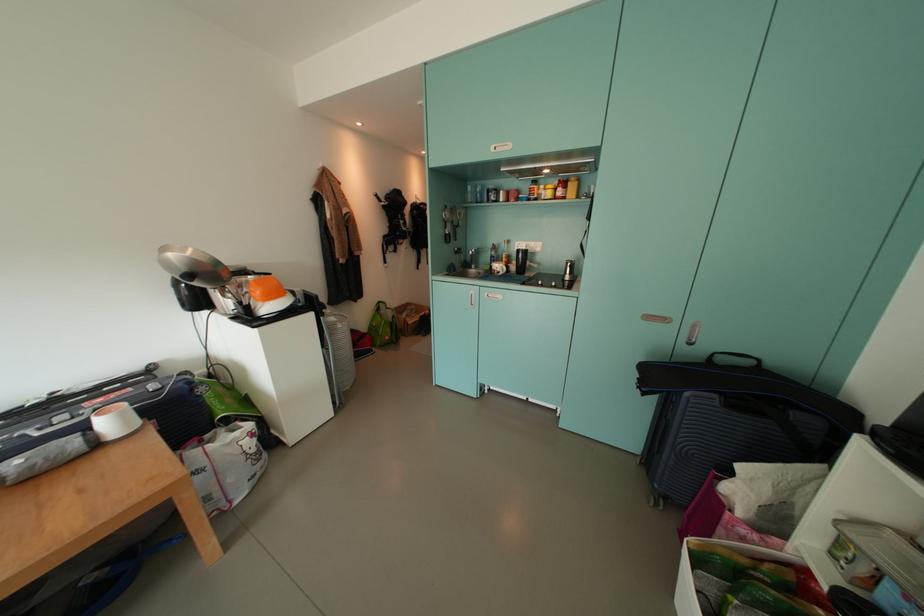
The width and height of the screenshot is (924, 616). What are the coordinates of `blue suitcase handle` in the screenshot? It's located at (735, 362).